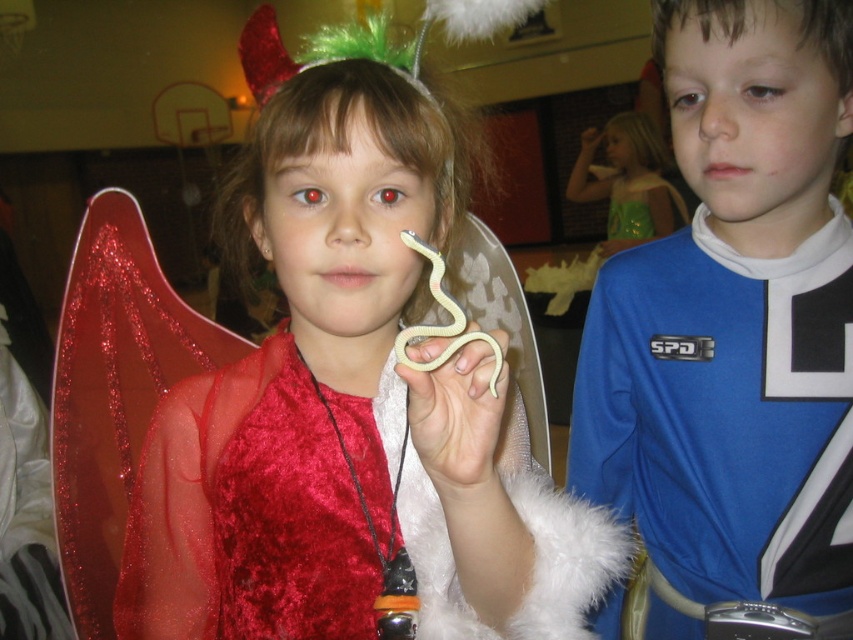
Question: Which point is closer to the camera?

Choices:
 (A) velvet red dress at center
 (B) white matte snake at center
 (C) matte yellow plastic snake at upper center

Answer: (A)

Question: Estimate the real-world distances between objects in this image. Which object is farther from the green velvet dress at upper right?

Choices:
 (A) matte yellow plastic snake at upper center
 (B) velvet red dress at center

Answer: (B)

Question: Can you confirm if white matte snake at center is positioned to the left of matte yellow plastic snake at upper center?

Choices:
 (A) no
 (B) yes

Answer: (B)

Question: Where is white matte snake at center located in relation to matte yellow plastic snake at upper center in the image?

Choices:
 (A) left
 (B) right

Answer: (A)

Question: Can you confirm if blue jersey at center is bigger than green velvet dress at upper right?

Choices:
 (A) yes
 (B) no

Answer: (B)

Question: Estimate the real-world distances between objects in this image. Which object is closer to the blue jersey at center?

Choices:
 (A) matte yellow plastic snake at upper center
 (B) green velvet dress at upper right
 (C) white matte snake at center

Answer: (C)